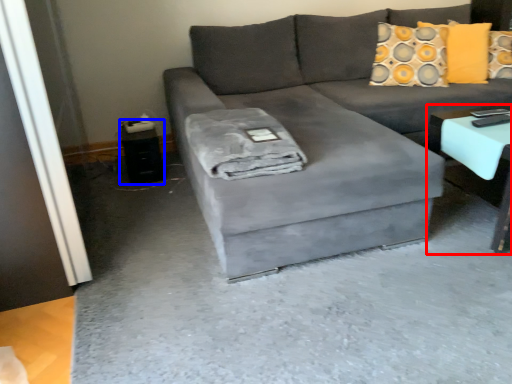
Question: Which of the following is the farthest to the observer, table (highlighted by a red box) or side table (highlighted by a blue box)?

Choices:
 (A) table
 (B) side table

Answer: (B)